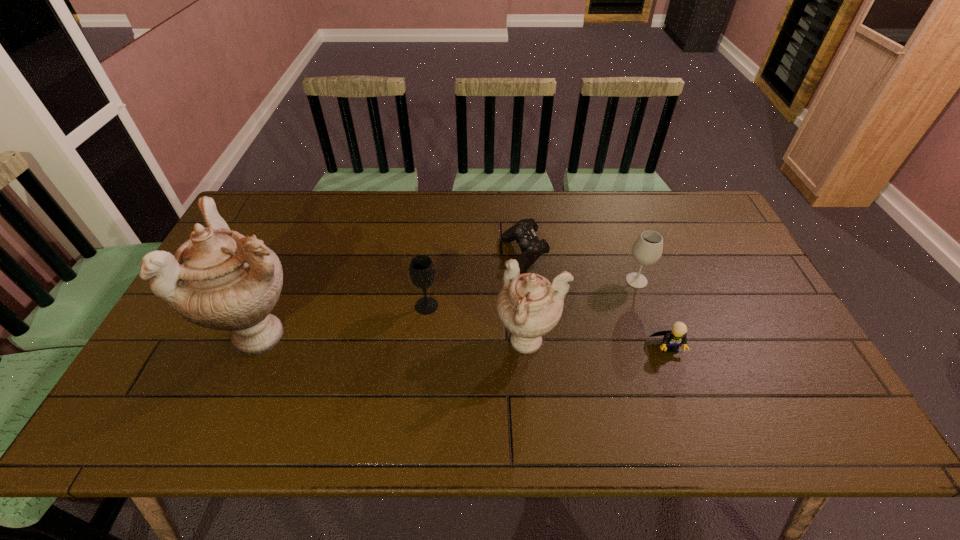
The urns are evenly distributed in the image. To maintain this, where would you place another urn on the right? Please point to a free space. Please provide its 2D coordinates. Your answer should be formatted as a tuple, i.e. [(x, y)], where the tuple contains the x and y coordinates of a point satisfying the conditions above.

[(803, 353)]